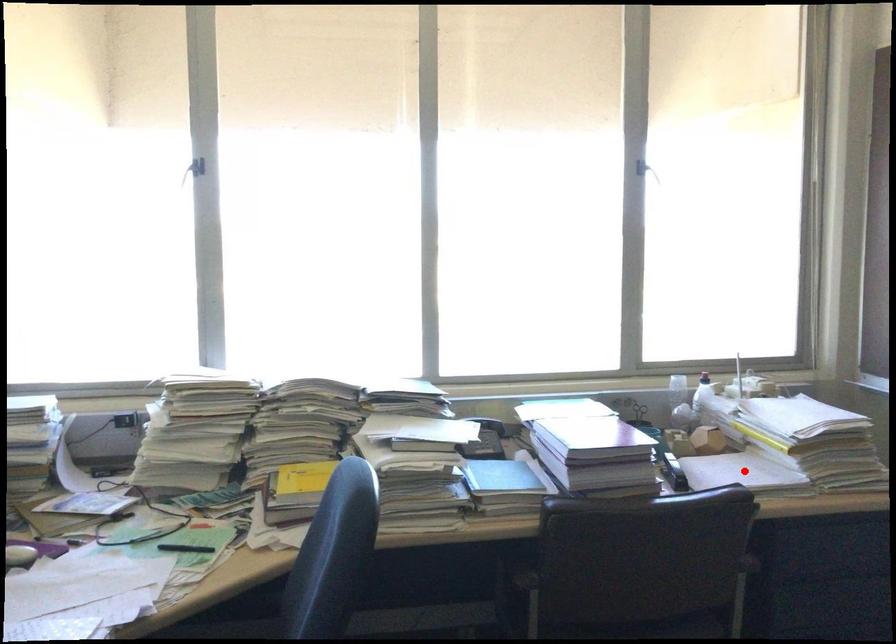
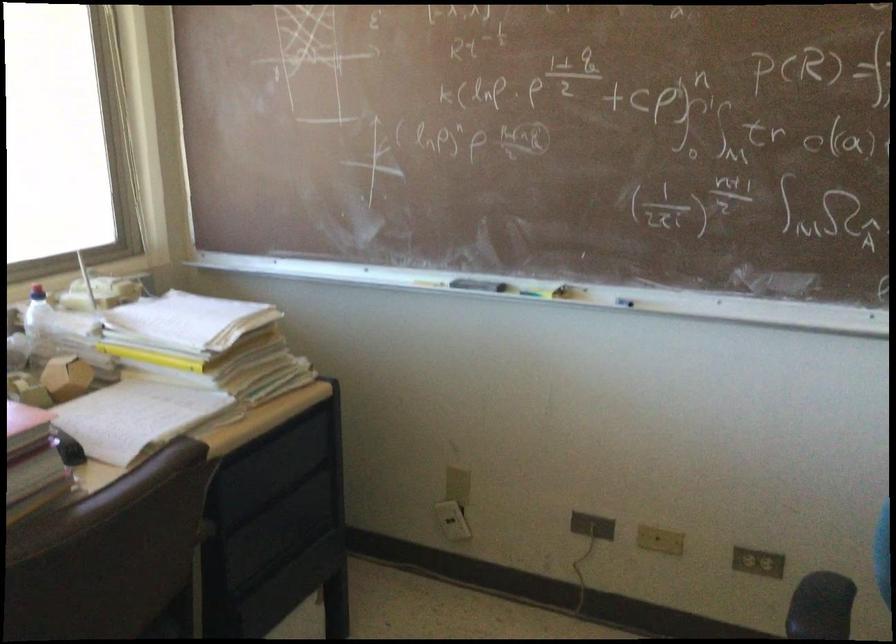
Question: I am providing you with two images of the same scene from different viewpoints. Image1 has a red point marked. In image2, the corresponding 3D location appears at what relative position? Reply with the corresponding letter.

Choices:
 (A) Closer
 (B) Farther

Answer: (A)